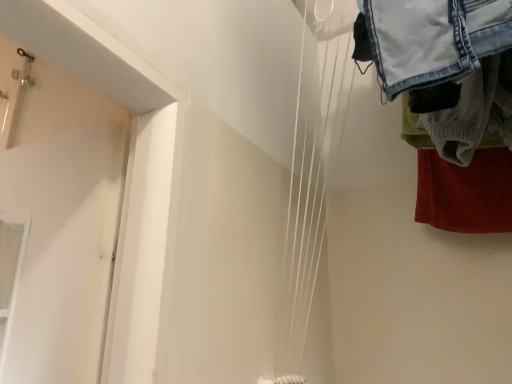
Question: From a real-world perspective, is white matte wires at center positioned over denim fabric laundry at upper right based on gravity?

Choices:
 (A) no
 (B) yes

Answer: (A)

Question: Is white matte wires at center to the left of denim fabric laundry at upper right from the viewer's perspective?

Choices:
 (A) no
 (B) yes

Answer: (B)

Question: Can you confirm if white matte wires at center is thinner than denim fabric laundry at upper right?

Choices:
 (A) yes
 (B) no

Answer: (A)

Question: Does white matte wires at center turn towards denim fabric laundry at upper right?

Choices:
 (A) no
 (B) yes

Answer: (B)

Question: Is white matte wires at center bigger than denim fabric laundry at upper right?

Choices:
 (A) no
 (B) yes

Answer: (A)

Question: Is denim fabric laundry at upper right a part of white matte wires at center?

Choices:
 (A) no
 (B) yes

Answer: (A)

Question: Could you tell me if denim fabric laundry at upper right is facing white matte wires at center?

Choices:
 (A) no
 (B) yes

Answer: (A)

Question: Is denim fabric laundry at upper right thinner than white matte wires at center?

Choices:
 (A) no
 (B) yes

Answer: (A)

Question: Considering the relative sizes of denim fabric laundry at upper right and white matte wires at center in the image provided, is denim fabric laundry at upper right taller than white matte wires at center?

Choices:
 (A) yes
 (B) no

Answer: (B)

Question: From the image's perspective, is denim fabric laundry at upper right located beneath white matte wires at center?

Choices:
 (A) yes
 (B) no

Answer: (B)

Question: Can you confirm if denim fabric laundry at upper right is wider than white matte wires at center?

Choices:
 (A) no
 (B) yes

Answer: (B)

Question: Would you say denim fabric laundry at upper right is outside white matte wires at center?

Choices:
 (A) yes
 (B) no

Answer: (A)

Question: In terms of width, does denim fabric laundry at upper right look wider or thinner when compared to white matte wires at center?

Choices:
 (A) wide
 (B) thin

Answer: (A)